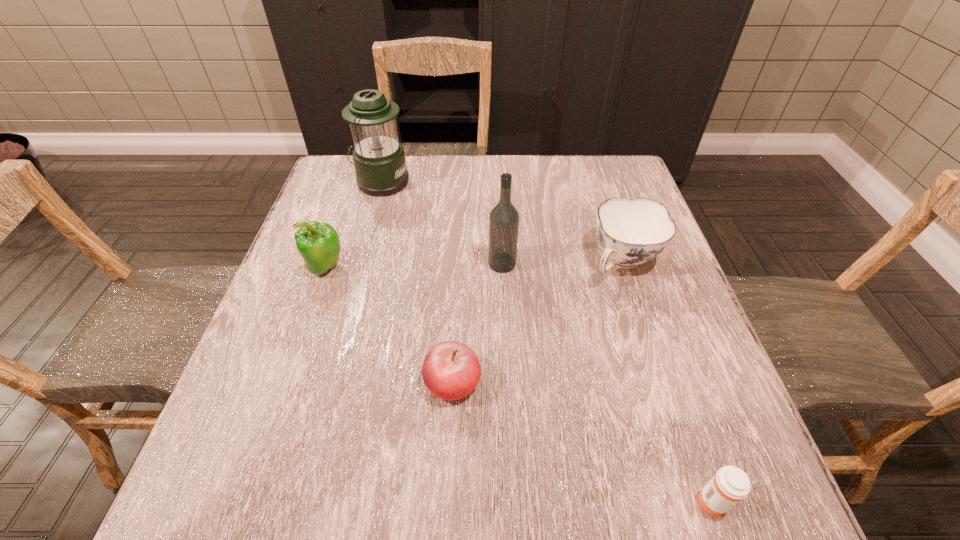
You are a GUI agent. You are given a task and a screenshot of the screen. Output one action in this format:
    pyautogui.click(x=<x>, y=<y>)
    Task: Click on the object positioned at the near right corner
    The width and height of the screenshot is (960, 540).
    Given the screenshot: What is the action you would take?
    pyautogui.click(x=730, y=484)

At what (x,y) coordinates should I click in order to perform the action: click on free region at the far edge. Please return your answer as a coordinate pair (x, y). This screenshot has height=540, width=960. Looking at the image, I should click on (573, 181).

What are the coordinates of `free region at the left edge of the desktop` in the screenshot? It's located at (271, 366).

I want to click on free space at the right edge of the desktop, so click(610, 301).

You are a GUI agent. You are given a task and a screenshot of the screen. Output one action in this format:
    pyautogui.click(x=<x>, y=<y>)
    Task: Click on the free space at the far left corner
    The width and height of the screenshot is (960, 540).
    Given the screenshot: What is the action you would take?
    pyautogui.click(x=339, y=170)

Find the location of a particular element. This screenshot has height=540, width=960. free point between the chinaware and the bell pepper is located at coordinates (474, 265).

Identify the location of vacant space that is in between the vodka and the lantern. (442, 222).

Find the location of a particular element. empty space that is in between the fifth farthest object and the medicine is located at coordinates (583, 441).

Image resolution: width=960 pixels, height=540 pixels. I want to click on unoccupied area between the vodka and the fifth farthest object, so click(x=477, y=323).

Find the location of a particular element. vacant point located between the third object from right to left and the chinaware is located at coordinates (563, 262).